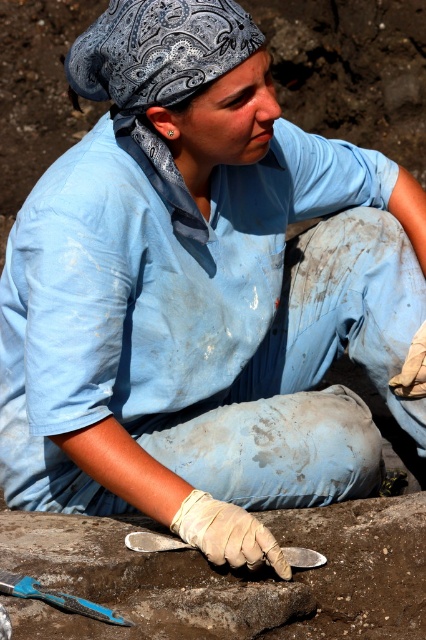
You are an archaeologist who needs to reach the blue plastic trowel at lower left from the smooth gray cement at lower center. Can you comfortably reach it without moving your position?

The distance between the smooth gray cement at lower center and the blue plastic trowel at lower left is 10.25 inches, so yes, you can comfortably reach it without moving your position.

You are an archaeologist working on a dig site. You have a smooth gray cement at lower center and a blue plastic trowel at lower left. Which object is larger in size?

The smooth gray cement at lower center is bigger than the blue plastic trowel at lower left according to the description.

You are an archaeologist working at the excavation site. You need to place a protective cover over the metallic silver trowel at center to prevent it from getting dirty. Where should you place the cover relative to the smooth gray cement at lower center?

You should place the protective cover to the left of the smooth gray cement at lower center because the metallic silver trowel at center is positioned to the left of the smooth gray cement at lower center.